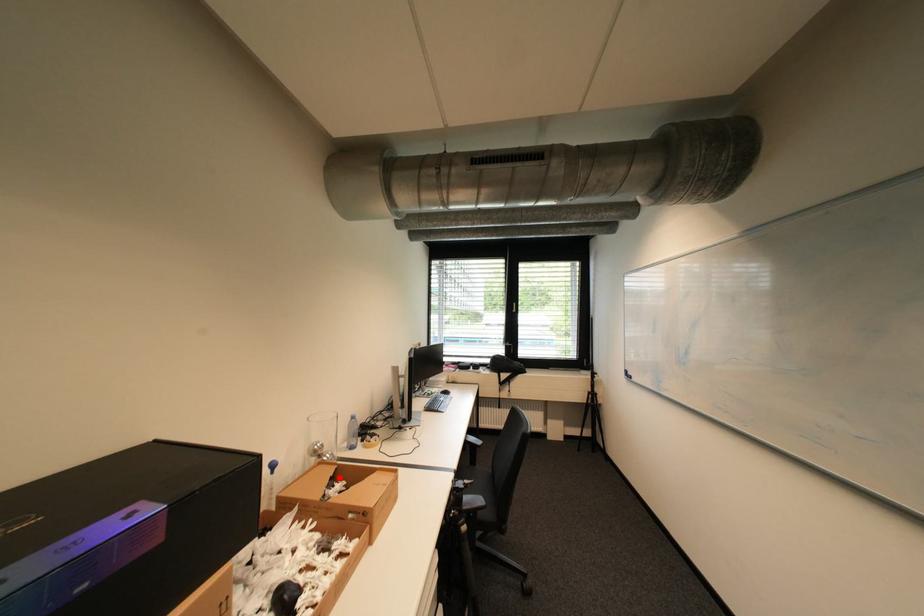
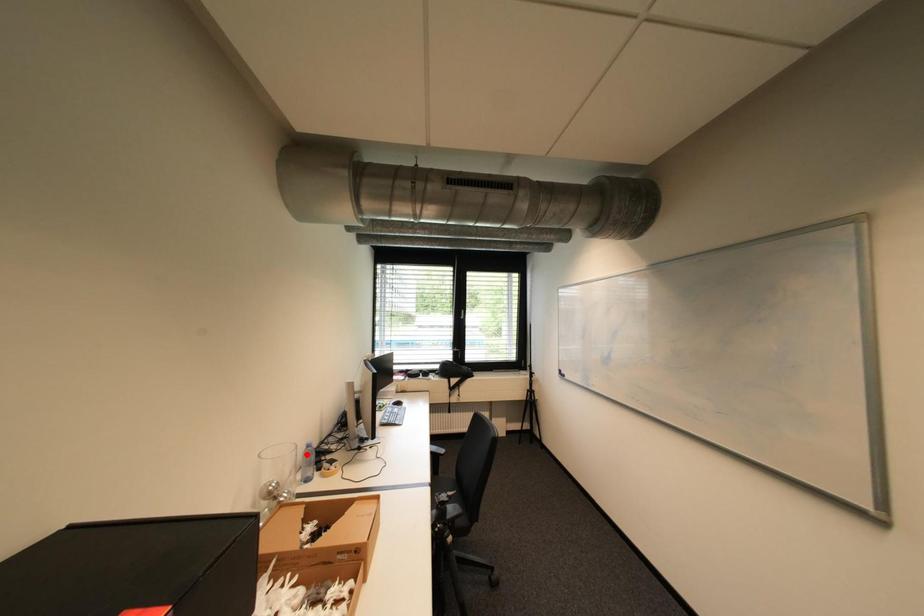
I am providing you with two images of the same scene from different viewpoints. A red point is marked on the first image and another point is marked on the second image. Do the highlighted points in image1 and image2 indicate the same real-world spot?

No